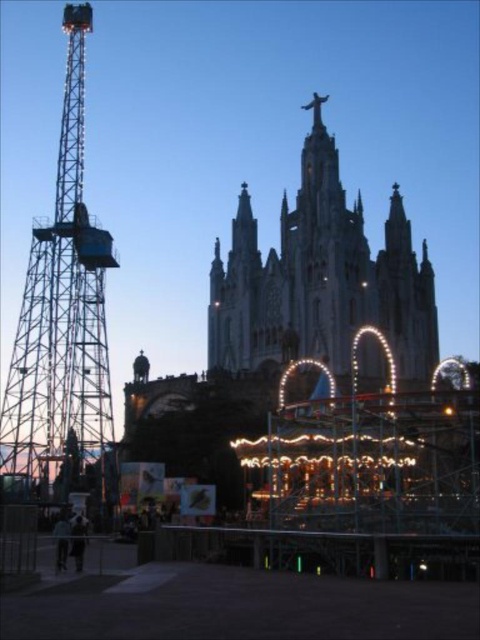
Question: Which point is farther from the camera taking this photo?

Choices:
 (A) (391, 250)
 (B) (28, 476)

Answer: (A)

Question: Is stone cathedral at center to the left of metallic structure at left from the viewer's perspective?

Choices:
 (A) no
 (B) yes

Answer: (A)

Question: Is stone cathedral at center to the right of metallic structure at left from the viewer's perspective?

Choices:
 (A) yes
 (B) no

Answer: (A)

Question: Which point is farther to the camera?

Choices:
 (A) (26, 406)
 (B) (252, 330)

Answer: (B)

Question: Can you confirm if stone cathedral at center is smaller than metallic structure at left?

Choices:
 (A) yes
 (B) no

Answer: (B)